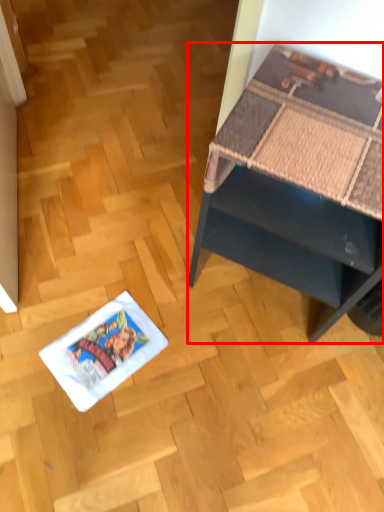
Question: From the image's perspective, considering the relative positions of desk (annotated by the red box) and comic book in the image provided, where is desk (annotated by the red box) located with respect to the staircase?

Choices:
 (A) above
 (B) below

Answer: (A)